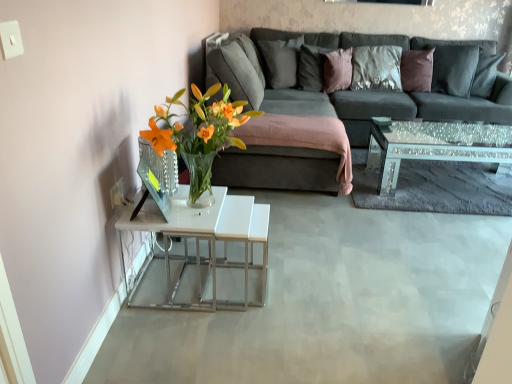
Describe the element at coordinates (434, 146) in the screenshot. This screenshot has height=384, width=512. I see `mirrored glass coffee table at right` at that location.

Where is `pink velvet pillow at upper center, placed as the 2th pillow when sorted from left to right`? The width and height of the screenshot is (512, 384). pink velvet pillow at upper center, placed as the 2th pillow when sorted from left to right is located at coordinates (312, 67).

The height and width of the screenshot is (384, 512). Describe the element at coordinates (312, 67) in the screenshot. I see `pink velvet pillow at upper center, placed as the 2th pillow when sorted from left to right` at that location.

Describe the element at coordinates (279, 62) in the screenshot. This screenshot has height=384, width=512. I see `velvet gray pillow at upper center, which appears as the third pillow when viewed from the right` at that location.

This screenshot has width=512, height=384. In order to click on mirrored glass coffee table at right in this screenshot , I will do `click(434, 146)`.

Considering the sizes of objects dark gray fabric couch at center and velvet gray pillow at upper center, the 1th pillow positioned from the left, in the image provided, who is wider, dark gray fabric couch at center or velvet gray pillow at upper center, the 1th pillow positioned from the left,?

dark gray fabric couch at center.

How many degrees apart are the facing directions of dark gray fabric couch at center and velvet gray pillow at upper center, the 1th pillow positioned from the left?

dark gray fabric couch at center and velvet gray pillow at upper center, the 1th pillow positioned from the left, are facing 35.4 degrees away from each other.

Is dark gray fabric couch at center looking in the opposite direction of velvet gray pillow at upper center, which appears as the third pillow when viewed from the right?

Yes, dark gray fabric couch at center is facing away from velvet gray pillow at upper center, which appears as the third pillow when viewed from the right.

Looking at the image, does pink velvet pillow at upper center, placed as the 2th pillow when sorted from left to right, seem bigger or smaller compared to dark gray fabric couch at center?

Considering their sizes, pink velvet pillow at upper center, placed as the 2th pillow when sorted from left to right, takes up less space than dark gray fabric couch at center.

From the image's perspective, which is below, pink velvet pillow at upper center, placed as the 2th pillow when sorted from left to right, or dark gray fabric couch at center?

dark gray fabric couch at center is shown below in the image.

Locate an element on the screen. studio couch located in front of the pink velvet pillow at upper center, which appears as the second pillow when viewed from the right is located at coordinates (361, 88).

Is pink velvet pillow at upper center, placed as the 2th pillow when sorted from left to right, turned away from dark gray fabric couch at center?

Yes, pink velvet pillow at upper center, placed as the 2th pillow when sorted from left to right, is positioned with its back facing dark gray fabric couch at center.

How different are the orientations of dark gray fabric couch at center and mirrored glass coffee table at right in degrees?

The facing directions of dark gray fabric couch at center and mirrored glass coffee table at right are 1.02 degrees apart.

Can you confirm if dark gray fabric couch at center is thinner than mirrored glass coffee table at right?

No, dark gray fabric couch at center is not thinner than mirrored glass coffee table at right.

Which is closer to the camera, (269, 35) or (471, 154)?

Point (269, 35) appears to be farther away from the viewer than point (471, 154).

Is dark gray fabric couch at center shorter than mirrored glass coffee table at right?

In fact, dark gray fabric couch at center may be taller than mirrored glass coffee table at right.

Considering the points (350, 61) and (387, 99), which point is in front, point (350, 61) or point (387, 99)?

The point (387, 99) is closer.

Measure the distance from pink velvet pillow at upper center, positioned as the first pillow in right-to-left order, to dark gray fabric couch at center.

pink velvet pillow at upper center, positioned as the first pillow in right-to-left order, and dark gray fabric couch at center are 21.12 inches apart.

Between pink velvet pillow at upper center, the third pillow viewed from the left, and dark gray fabric couch at center, which one has larger width?

dark gray fabric couch at center.

Would you say pink velvet pillow at upper center, positioned as the first pillow in right-to-left order, is outside dark gray fabric couch at center?

No, pink velvet pillow at upper center, positioned as the first pillow in right-to-left order, is inside dark gray fabric couch at center's boundary.

Considering the sizes of objects dark gray fabric couch at center and pink velvet pillow at upper center, which appears as the second pillow when viewed from the right, in the image provided, who is taller, dark gray fabric couch at center or pink velvet pillow at upper center, which appears as the second pillow when viewed from the right,?

dark gray fabric couch at center is taller.

Does dark gray fabric couch at center have a greater width compared to pink velvet pillow at upper center, which appears as the second pillow when viewed from the right?

Indeed, dark gray fabric couch at center has a greater width compared to pink velvet pillow at upper center, which appears as the second pillow when viewed from the right.

How many degrees apart are the facing directions of dark gray fabric couch at center and pink velvet pillow at upper center, which appears as the second pillow when viewed from the right?

The facing directions of dark gray fabric couch at center and pink velvet pillow at upper center, which appears as the second pillow when viewed from the right, are 29.9 degrees apart.

Considering the sizes of objects pink velvet pillow at upper center, the third pillow viewed from the left, and pink velvet pillow at upper center, which appears as the second pillow when viewed from the right, in the image provided, who is shorter, pink velvet pillow at upper center, the third pillow viewed from the left, or pink velvet pillow at upper center, which appears as the second pillow when viewed from the right,?

With less height is pink velvet pillow at upper center, the third pillow viewed from the left.

Can you see pink velvet pillow at upper center, the third pillow viewed from the left, touching pink velvet pillow at upper center, which appears as the second pillow when viewed from the right?

No, pink velvet pillow at upper center, the third pillow viewed from the left, is not next to pink velvet pillow at upper center, which appears as the second pillow when viewed from the right.

Considering the positions of points (326, 90) and (320, 60), is point (326, 90) farther from camera compared to point (320, 60)?

No, (326, 90) is closer to viewer.

From the image's perspective, which is above, pink velvet pillow at upper center, positioned as the first pillow in right-to-left order, or pink velvet pillow at upper center, which appears as the second pillow when viewed from the right?

pink velvet pillow at upper center, which appears as the second pillow when viewed from the right, appears higher in the image.

Is point (287, 77) closer or farther from the camera than point (336, 51)?

Point (287, 77) is positioned farther from the camera compared to point (336, 51).

Which of these two, velvet gray pillow at upper center, which appears as the third pillow when viewed from the right, or pink velvet pillow at upper center, the third pillow viewed from the left, is wider?

Wider between the two is velvet gray pillow at upper center, which appears as the third pillow when viewed from the right.

From the image's perspective, is velvet gray pillow at upper center, the 1th pillow positioned from the left, positioned above or below pink velvet pillow at upper center, the third pillow viewed from the left?

velvet gray pillow at upper center, the 1th pillow positioned from the left, is situated higher than pink velvet pillow at upper center, the third pillow viewed from the left, in the image.

In the scene shown: Is velvet gray pillow at upper center, which appears as the third pillow when viewed from the right, positioned before pink velvet pillow at upper center, positioned as the first pillow in right-to-left order?

No, it is behind pink velvet pillow at upper center, positioned as the first pillow in right-to-left order.

Identify the location of pillow that is the 2nd object located behind the dark gray fabric couch at center. Image resolution: width=512 pixels, height=384 pixels. (279, 62).

Where is `studio couch below the pink velvet pillow at upper center, which appears as the second pillow when viewed from the right (from a real-world perspective)`? The width and height of the screenshot is (512, 384). studio couch below the pink velvet pillow at upper center, which appears as the second pillow when viewed from the right (from a real-world perspective) is located at coordinates (361, 88).

Estimate the real-world distances between objects in this image. Which object is further from pink velvet pillow at upper center, which appears as the second pillow when viewed from the right, mirrored glass coffee table at right or velvet gray pillow at upper center, which appears as the third pillow when viewed from the right?

mirrored glass coffee table at right.

Estimate the real-world distances between objects in this image. Which object is further from mirrored glass coffee table at right, velvet gray pillow at upper center, the 1th pillow positioned from the left, or pink velvet pillow at upper center, positioned as the first pillow in right-to-left order?

The object further to mirrored glass coffee table at right is velvet gray pillow at upper center, the 1th pillow positioned from the left.

Estimate the real-world distances between objects in this image. Which object is further from dark gray fabric couch at center, velvet gray pillow at upper center, which appears as the third pillow when viewed from the right, or mirrored glass coffee table at right?

mirrored glass coffee table at right lies further to dark gray fabric couch at center than the other object.

Consider the image. Which object lies further to the anchor point velvet gray pillow at upper center, the 1th pillow positioned from the left, mirrored glass coffee table at right or dark gray fabric couch at center?

→ mirrored glass coffee table at right lies further to velvet gray pillow at upper center, the 1th pillow positioned from the left, than the other object.

Considering their positions, is mirrored glass coffee table at right positioned further to dark gray fabric couch at center than pink velvet pillow at upper center, placed as the 2th pillow when sorted from left to right?

mirrored glass coffee table at right is positioned further to the anchor dark gray fabric couch at center.

In the scene shown: Considering their positions, is velvet gray pillow at upper center, which appears as the third pillow when viewed from the right, positioned further to pink velvet pillow at upper center, positioned as the first pillow in right-to-left order, than dark gray fabric couch at center?

dark gray fabric couch at center.

When comparing their distances from dark gray fabric couch at center, does pink velvet pillow at upper center, the third pillow viewed from the left, or velvet gray pillow at upper center, which appears as the third pillow when viewed from the right, seem further?

pink velvet pillow at upper center, the third pillow viewed from the left.

Estimate the real-world distances between objects in this image. Which object is closer to pink velvet pillow at upper center, which appears as the second pillow when viewed from the right, pink velvet pillow at upper center, positioned as the first pillow in right-to-left order, or mirrored glass coffee table at right?

Among the two, pink velvet pillow at upper center, positioned as the first pillow in right-to-left order, is located nearer to pink velvet pillow at upper center, which appears as the second pillow when viewed from the right.

The height and width of the screenshot is (384, 512). Find the location of `coffee table positioned between dark gray fabric couch at center and pink velvet pillow at upper center, which appears as the second pillow when viewed from the right, from near to far`. coffee table positioned between dark gray fabric couch at center and pink velvet pillow at upper center, which appears as the second pillow when viewed from the right, from near to far is located at coordinates (434, 146).

This screenshot has height=384, width=512. I want to click on pillow located between velvet gray pillow at upper center, which appears as the third pillow when viewed from the right, and pink velvet pillow at upper center, positioned as the first pillow in right-to-left order, in the left-right direction, so click(312, 67).

Find the location of a particular element. coffee table located between dark gray fabric couch at center and pink velvet pillow at upper center, positioned as the first pillow in right-to-left order, in the depth direction is located at coordinates (434, 146).

You are a GUI agent. You are given a task and a screenshot of the screen. Output one action in this format:
    pyautogui.click(x=<x>, y=<y>)
    Task: Click on the coffee table between dark gray fabric couch at center and velvet gray pillow at upper center, which appears as the third pillow when viewed from the right, from front to back
    
    Given the screenshot: What is the action you would take?
    [x=434, y=146]